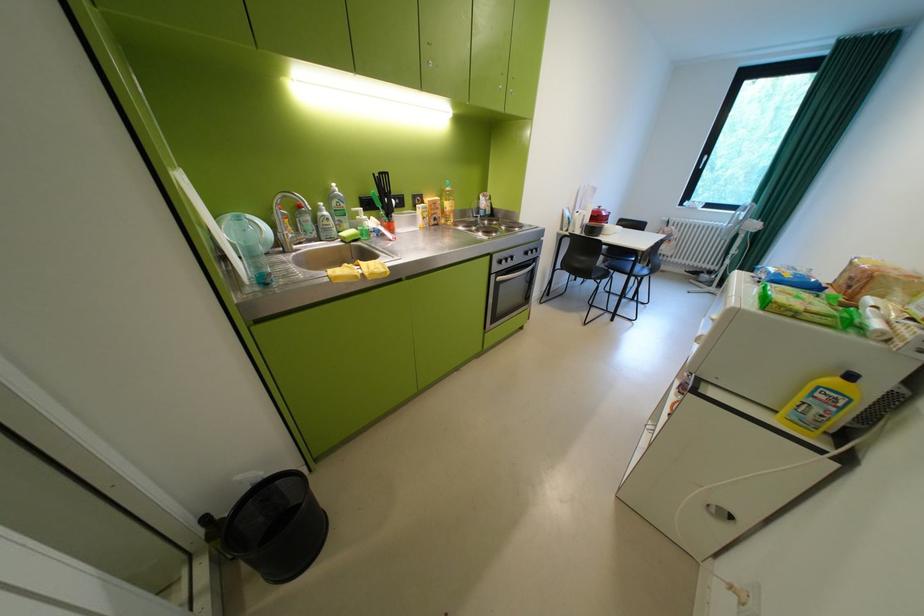
Where would you pull the refrigerator door handle? Please return your answer as a coordinate pair (x, y).

(698, 339)